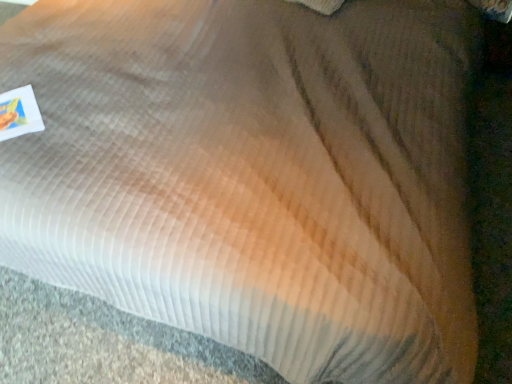
This screenshot has width=512, height=384. What are the coordinates of `white paper postcard at upper left` in the screenshot? It's located at (19, 113).

What do you see at coordinates (19, 113) in the screenshot? The height and width of the screenshot is (384, 512). I see `white paper postcard at upper left` at bounding box center [19, 113].

Locate an element on the screen. white paper postcard at upper left is located at coordinates (19, 113).